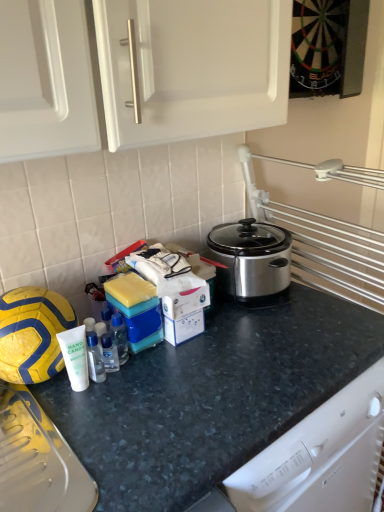
Question: Is dark gray granite countertop at center beside clear plastic bottle at center, which appears as the 2th bottle when viewed from the back?

Choices:
 (A) yes
 (B) no

Answer: (B)

Question: Is dark gray granite countertop at center completely or partially outside of clear plastic bottle at center, the 1th bottle in the left-to-right sequence?

Choices:
 (A) no
 (B) yes

Answer: (B)

Question: From the image's perspective, is dark gray granite countertop at center under clear plastic bottle at center, which is the 2th bottle in right-to-left order?

Choices:
 (A) no
 (B) yes

Answer: (B)

Question: Is dark gray granite countertop at center positioned behind clear plastic bottle at center, which is the 2th bottle in right-to-left order?

Choices:
 (A) yes
 (B) no

Answer: (B)

Question: Is dark gray granite countertop at center taller than clear plastic bottle at center, which is the 2th bottle in right-to-left order?

Choices:
 (A) yes
 (B) no

Answer: (A)

Question: Is yellow matte football at left taller or shorter than dark gray granite countertop at center?

Choices:
 (A) short
 (B) tall

Answer: (A)

Question: Based on their sizes in the image, would you say yellow matte football at left is bigger or smaller than dark gray granite countertop at center?

Choices:
 (A) small
 (B) big

Answer: (A)

Question: Which is correct: yellow matte football at left is inside dark gray granite countertop at center, or outside of it?

Choices:
 (A) outside
 (B) inside

Answer: (A)

Question: Is yellow matte football at left to the left or to the right of dark gray granite countertop at center in the image?

Choices:
 (A) right
 (B) left

Answer: (B)

Question: From a real-world perspective, is transparent plastic bottle at center, positioned as the 1th bottle in right-to-left order, above or below dark gray granite countertop at center?

Choices:
 (A) above
 (B) below

Answer: (A)

Question: Considering their positions, is transparent plastic bottle at center, arranged as the 2th bottle when viewed from the front, located in front of or behind dark gray granite countertop at center?

Choices:
 (A) behind
 (B) front

Answer: (A)

Question: Based on their sizes in the image, would you say transparent plastic bottle at center, marked as the first bottle in a back-to-front arrangement, is bigger or smaller than dark gray granite countertop at center?

Choices:
 (A) big
 (B) small

Answer: (B)

Question: Is transparent plastic bottle at center, positioned as the 1th bottle in right-to-left order, wider or thinner than dark gray granite countertop at center?

Choices:
 (A) wide
 (B) thin

Answer: (B)

Question: Considering their positions, is transparent plastic bottle at center, the 2th bottle positioned from the left, located in front of or behind clear plastic bottle at center, which appears as the 2th bottle when viewed from the back?

Choices:
 (A) behind
 (B) front

Answer: (A)

Question: Considering the positions of transparent plastic bottle at center, arranged as the 2th bottle when viewed from the front, and clear plastic bottle at center, the 1th bottle in the left-to-right sequence, in the image, is transparent plastic bottle at center, arranged as the 2th bottle when viewed from the front, wider or thinner than clear plastic bottle at center, the 1th bottle in the left-to-right sequence,?

Choices:
 (A) wide
 (B) thin

Answer: (B)